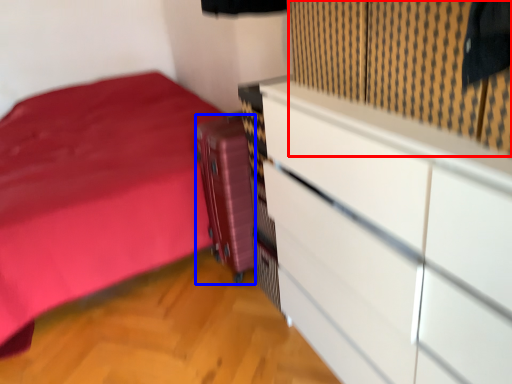
Question: Which object appears closest to the camera in this image, curtain (highlighted by a red box) or luggage (highlighted by a blue box)?

Choices:
 (A) curtain
 (B) luggage

Answer: (A)